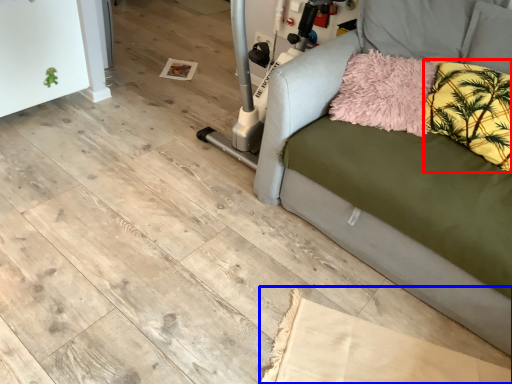
Question: Which object appears farthest to the camera in this image, pillow (highlighted by a red box) or cardboard (highlighted by a blue box)?

Choices:
 (A) pillow
 (B) cardboard

Answer: (A)